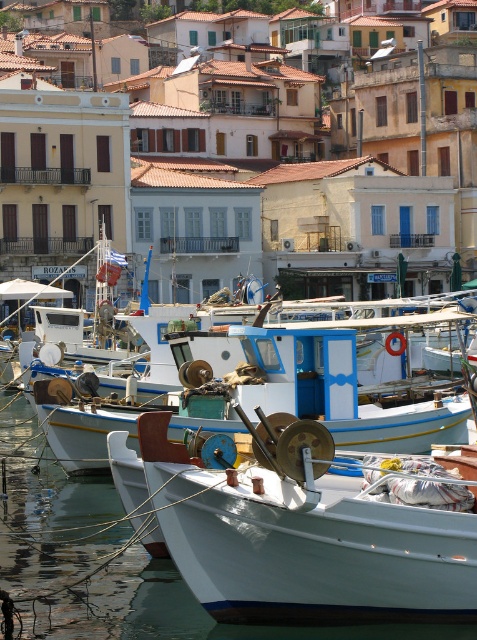
Question: Does white matte boat at center have a lesser width compared to white painted wood boat at center?

Choices:
 (A) no
 (B) yes

Answer: (B)

Question: Can you confirm if white matte boat at center is positioned below white painted wood boat at center?

Choices:
 (A) no
 (B) yes

Answer: (B)

Question: Does white matte boat at center have a lesser width compared to white painted wood boat at center?

Choices:
 (A) no
 (B) yes

Answer: (B)